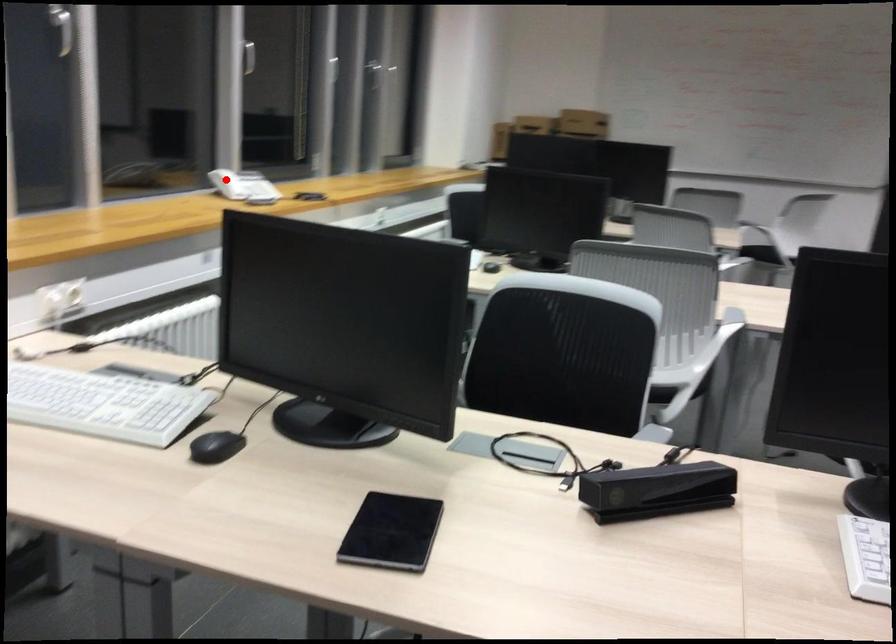
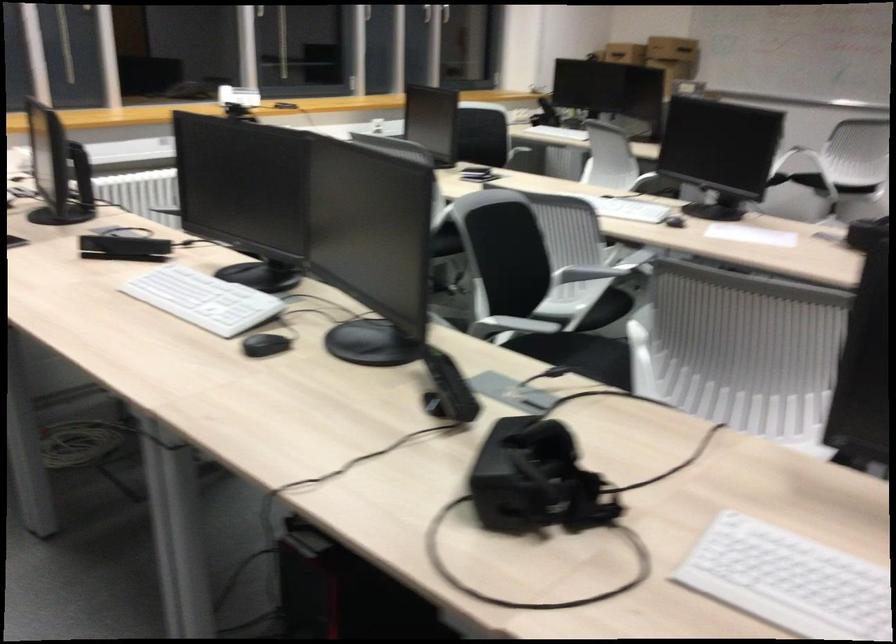
In the second image, find the point that corresponds to the highlighted location in the first image.

(238, 96)